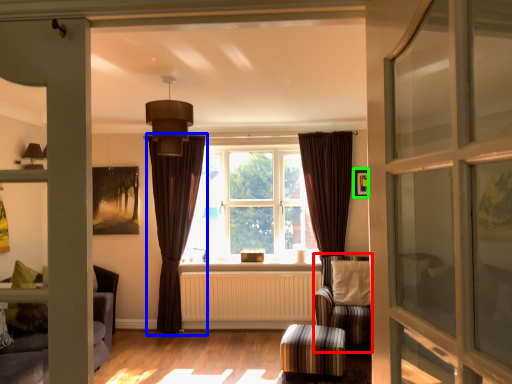
Question: Based on their relative distances, which object is nearer to armchair (highlighted by a red box)? Choose from curtain (highlighted by a blue box) and picture frame (highlighted by a green box).

Choices:
 (A) curtain
 (B) picture frame

Answer: (B)